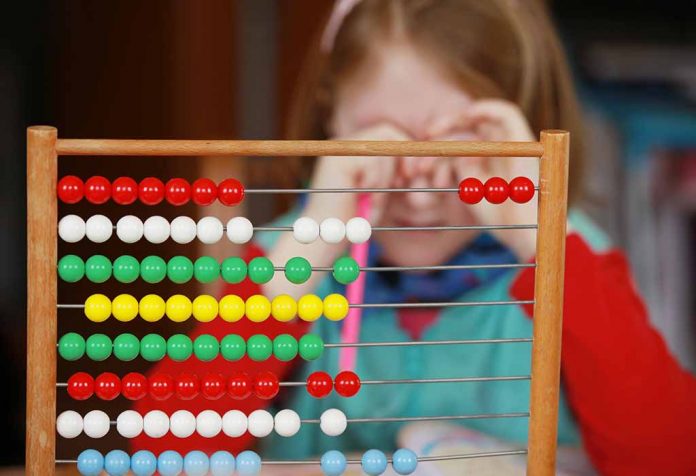
In order to click on light blue counting beads for the abucus in this screenshot , I will do `click(88, 462)`, `click(117, 463)`, `click(149, 466)`, `click(177, 467)`, `click(200, 469)`, `click(221, 467)`, `click(246, 466)`, `click(333, 461)`, `click(377, 458)`, `click(404, 458)`.